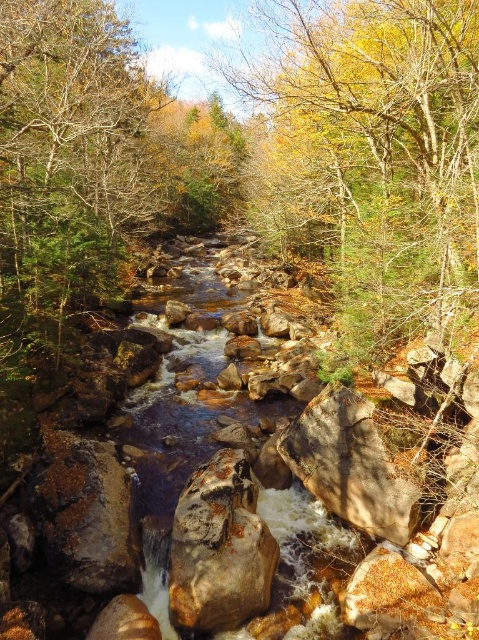
In the scene shown: Can you confirm if brown wood tree at center is bigger than brown rough rock at center?

Yes.

Does brown wood tree at center have a lesser width compared to brown rough rock at center?

No.

Does point (94, 280) come in front of point (398, 536)?

No, (94, 280) is further to viewer.

Find the location of a particular element. This screenshot has width=479, height=640. brown wood tree at center is located at coordinates (67, 164).

Looking at this image, does yellow-green leaves at center have a lesser height compared to brown rough rock at center?

No, yellow-green leaves at center is not shorter than brown rough rock at center.

Can you confirm if yellow-green leaves at center is bigger than brown rough rock at center?

Yes.

This screenshot has height=640, width=479. What are the coordinates of `yellow-green leaves at center` in the screenshot? It's located at (377, 154).

Where is `yellow-green leaves at center`? yellow-green leaves at center is located at coordinates (377, 154).

What do you see at coordinates (377, 154) in the screenshot? Image resolution: width=479 pixels, height=640 pixels. I see `yellow-green leaves at center` at bounding box center [377, 154].

Between point (420, 61) and point (68, 17), which one is positioned in front?

Point (420, 61) is in front.

Where is `yellow-green leaves at center`? The height and width of the screenshot is (640, 479). yellow-green leaves at center is located at coordinates pyautogui.click(x=377, y=154).